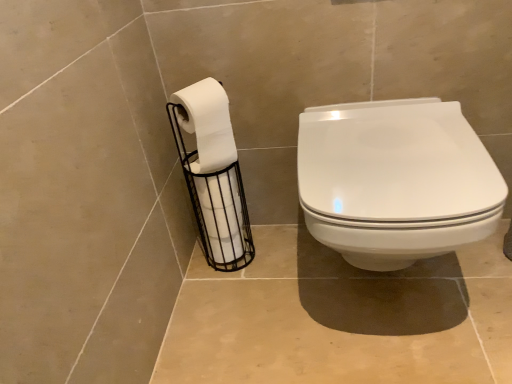
Question: Considering the relative sizes of white matte toilet paper at left, marked as the 2th toilet paper in a top-to-bottom arrangement, and white matte toilet paper at left, which appears as the 1th toilet paper when viewed from the top, in the image provided, is white matte toilet paper at left, marked as the 2th toilet paper in a top-to-bottom arrangement, thinner than white matte toilet paper at left, which appears as the 1th toilet paper when viewed from the top,?

Choices:
 (A) no
 (B) yes

Answer: (A)

Question: Does white matte toilet paper at left, the 1th toilet paper when ordered from bottom to top, have a smaller size compared to white matte toilet paper at left, which ranks as the second toilet paper in bottom-to-top order?

Choices:
 (A) yes
 (B) no

Answer: (B)

Question: Does white matte toilet paper at left, marked as the 2th toilet paper in a top-to-bottom arrangement, have a larger size compared to white matte toilet paper at left, which appears as the 1th toilet paper when viewed from the top?

Choices:
 (A) no
 (B) yes

Answer: (B)

Question: Considering the relative sizes of white matte toilet paper at left, the 1th toilet paper when ordered from bottom to top, and white matte toilet paper at left, which ranks as the second toilet paper in bottom-to-top order, in the image provided, is white matte toilet paper at left, the 1th toilet paper when ordered from bottom to top, wider than white matte toilet paper at left, which ranks as the second toilet paper in bottom-to-top order,?

Choices:
 (A) no
 (B) yes

Answer: (B)

Question: Is white matte toilet paper at left, the 1th toilet paper when ordered from bottom to top, shorter than white matte toilet paper at left, which ranks as the second toilet paper in bottom-to-top order?

Choices:
 (A) no
 (B) yes

Answer: (A)

Question: In terms of width, does white glossy toilet seat at center look wider or thinner when compared to white matte toilet paper at left, marked as the 2th toilet paper in a top-to-bottom arrangement?

Choices:
 (A) wide
 (B) thin

Answer: (A)

Question: Considering their positions, is white glossy toilet seat at center located in front of or behind white matte toilet paper at left, the 1th toilet paper when ordered from bottom to top?

Choices:
 (A) behind
 (B) front

Answer: (B)

Question: From a real-world perspective, relative to white matte toilet paper at left, the 1th toilet paper when ordered from bottom to top, is white glossy toilet seat at center vertically above or below?

Choices:
 (A) above
 (B) below

Answer: (A)

Question: Is point (320, 137) positioned closer to the camera than point (208, 94)?

Choices:
 (A) closer
 (B) farther

Answer: (A)

Question: From a real-world perspective, relative to white matte toilet paper at left, which ranks as the second toilet paper in bottom-to-top order, is white matte toilet paper at left, marked as the 2th toilet paper in a top-to-bottom arrangement, vertically above or below?

Choices:
 (A) above
 (B) below

Answer: (B)

Question: Looking at their shapes, would you say white matte toilet paper at left, marked as the 2th toilet paper in a top-to-bottom arrangement, is wider or thinner than white matte toilet paper at left, which appears as the 1th toilet paper when viewed from the top?

Choices:
 (A) wide
 (B) thin

Answer: (A)

Question: Is white matte toilet paper at left, the 1th toilet paper when ordered from bottom to top, bigger or smaller than white matte toilet paper at left, which ranks as the second toilet paper in bottom-to-top order?

Choices:
 (A) small
 (B) big

Answer: (B)

Question: Is point (214, 117) positioned closer to the camera than point (192, 86)?

Choices:
 (A) closer
 (B) farther

Answer: (B)

Question: Considering the relative positions of white matte toilet paper at left, which ranks as the second toilet paper in bottom-to-top order, and white matte toilet paper at left, marked as the 2th toilet paper in a top-to-bottom arrangement, in the image provided, is white matte toilet paper at left, which ranks as the second toilet paper in bottom-to-top order, to the left or to the right of white matte toilet paper at left, marked as the 2th toilet paper in a top-to-bottom arrangement,?

Choices:
 (A) left
 (B) right

Answer: (A)

Question: From their relative heights in the image, would you say white matte toilet paper at left, which ranks as the second toilet paper in bottom-to-top order, is taller or shorter than white matte toilet paper at left, marked as the 2th toilet paper in a top-to-bottom arrangement?

Choices:
 (A) short
 (B) tall

Answer: (A)